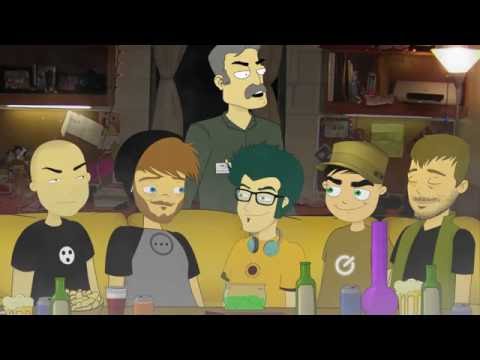
The image size is (480, 360). What are the coordinates of `purple bong` in the screenshot? It's located at (384, 291).